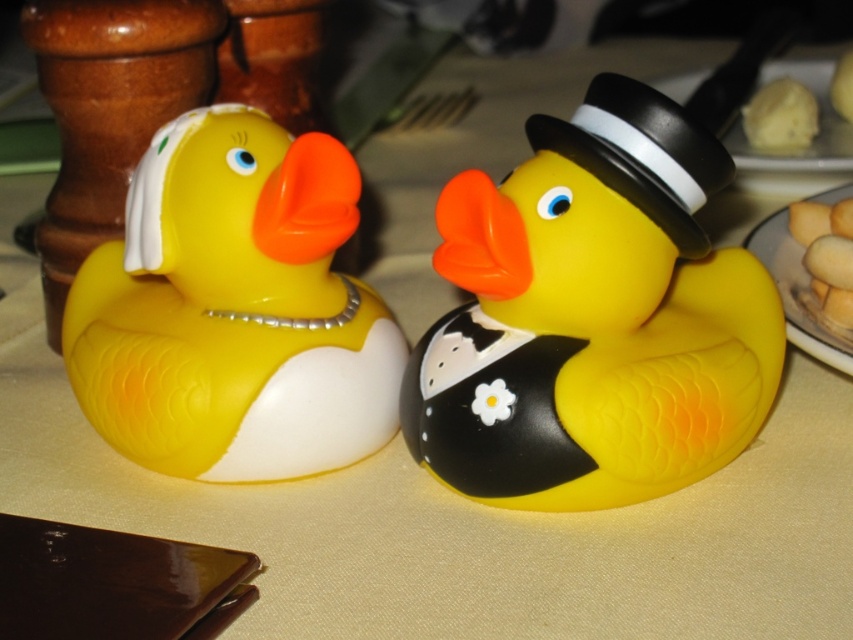
Between rubber yellow duck at center and matte rubber duck at left, which one appears on the left side from the viewer's perspective?

matte rubber duck at left is more to the left.

Is point (434, 266) farther from viewer compared to point (339, 336)?

No, (434, 266) is closer to viewer.

What do you see at coordinates (592, 316) in the screenshot? The height and width of the screenshot is (640, 853). I see `rubber yellow duck at center` at bounding box center [592, 316].

At what (x,y) coordinates should I click in order to perform the action: click on rubber yellow duck at center. Please return your answer as a coordinate pair (x, y). The height and width of the screenshot is (640, 853). Looking at the image, I should click on (592, 316).

Who is positioned more to the left, matte white porcelain at right or yellow sponge cake at upper right?

From the viewer's perspective, matte white porcelain at right appears more on the left side.

Between point (786, 292) and point (840, 108), which one is positioned behind?

Positioned behind is point (840, 108).

The height and width of the screenshot is (640, 853). In order to click on matte white porcelain at right in this screenshot , I will do `click(798, 292)`.

Can you confirm if matte white porcelain at right is taller than golden sponge cake at right?

Correct, matte white porcelain at right is much taller as golden sponge cake at right.

Which is behind, point (770, 227) or point (795, 236)?

Point (770, 227)

Identify the location of matte white porcelain at right. Image resolution: width=853 pixels, height=640 pixels. (798, 292).